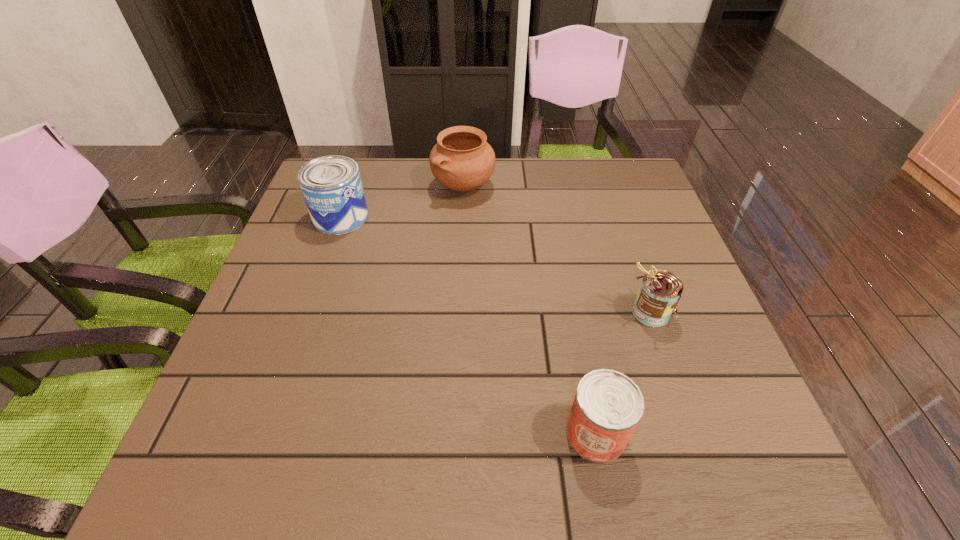
The width and height of the screenshot is (960, 540). I want to click on vacant position in the image that satisfies the following two spatial constraints: 1. on the front label of the nearest object; 2. on the right side of the farthest can, so click(265, 434).